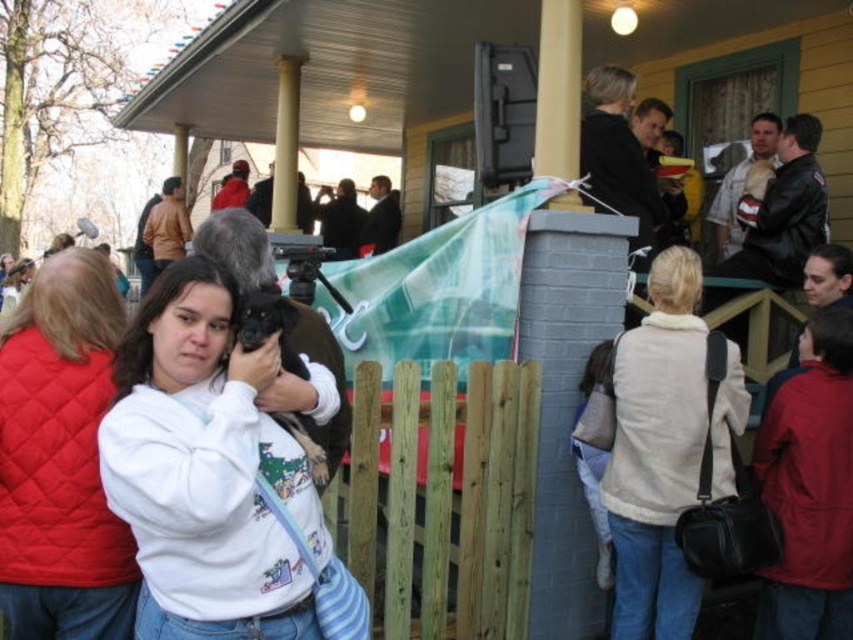
Who is positioned more to the left, white fleece sweatshirt at center or beige fleece vest at upper right?

white fleece sweatshirt at center is more to the left.

Is point (158, 314) more distant than point (693, 442)?

That is False.

You are a GUI agent. You are given a task and a screenshot of the screen. Output one action in this format:
    pyautogui.click(x=<x>, y=<y>)
    Task: Click on the white fleece sweatshirt at center
    The image size is (853, 640).
    Given the screenshot: What is the action you would take?
    pyautogui.click(x=222, y=472)

Is white fleece sweatshirt at center to the right of brown wooden fence at center from the viewer's perspective?

In fact, white fleece sweatshirt at center is to the left of brown wooden fence at center.

Who is more distant from viewer, (x=144, y=628) or (x=514, y=572)?

The point (x=514, y=572) is more distant.

Where is `white fleece sweatshirt at center`? white fleece sweatshirt at center is located at coordinates (222, 472).

Is white quilted vest at center shorter than white painted wood column at upper center?

Yes, white quilted vest at center is shorter than white painted wood column at upper center.

Is white quilted vest at center positioned before white painted wood column at upper center?

Yes, white quilted vest at center is closer to the viewer.

This screenshot has height=640, width=853. In order to click on white quilted vest at center in this screenshot , I will do `click(61, 458)`.